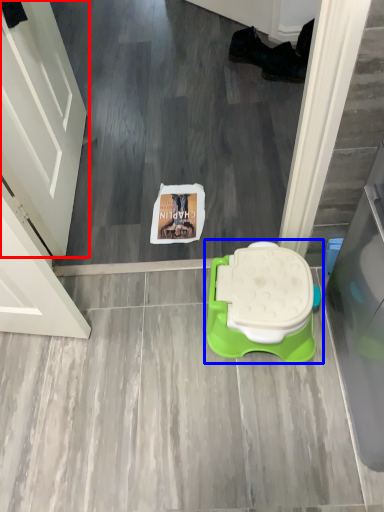
Question: Which point is further to the camera, door (highlighted by a red box) or toilet (highlighted by a blue box)?

Choices:
 (A) door
 (B) toilet

Answer: (B)